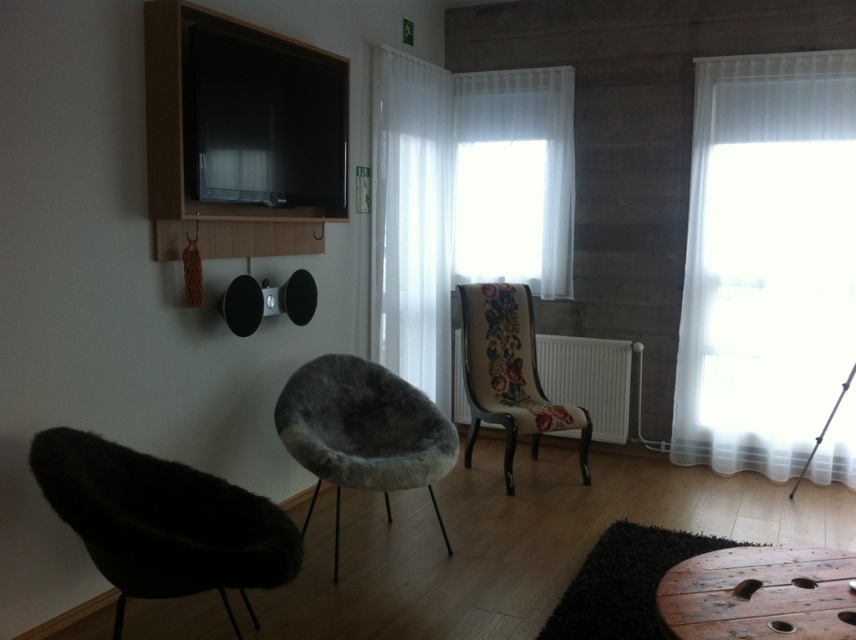
Question: Can you confirm if fuzzy gray armchair at center is wider than floral fabric chair at center?

Choices:
 (A) no
 (B) yes

Answer: (B)

Question: From the image, what is the correct spatial relationship of dark brown fur armchair at lower left in relation to fuzzy gray armchair at center?

Choices:
 (A) right
 (B) left

Answer: (B)

Question: Which of the following is the closest to the observer?

Choices:
 (A) (412, 378)
 (B) (138, 508)

Answer: (B)

Question: Which point is closer to the camera taking this photo?

Choices:
 (A) (507, 113)
 (B) (339, 486)
 (C) (530, 388)

Answer: (B)

Question: Can you confirm if white sheer curtain at right is positioned below white sheer curtain at center?

Choices:
 (A) yes
 (B) no

Answer: (A)

Question: Which of the following is the farthest from the observer?

Choices:
 (A) (771, 586)
 (B) (507, 493)
 (C) (423, 157)
 (D) (694, 109)

Answer: (C)